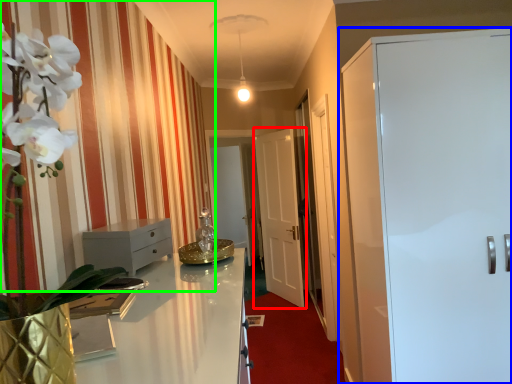
Question: Which is nearer to the door (highlighted by a red box)? door (highlighted by a blue box) or curtain (highlighted by a green box).

Choices:
 (A) door
 (B) curtain

Answer: (B)